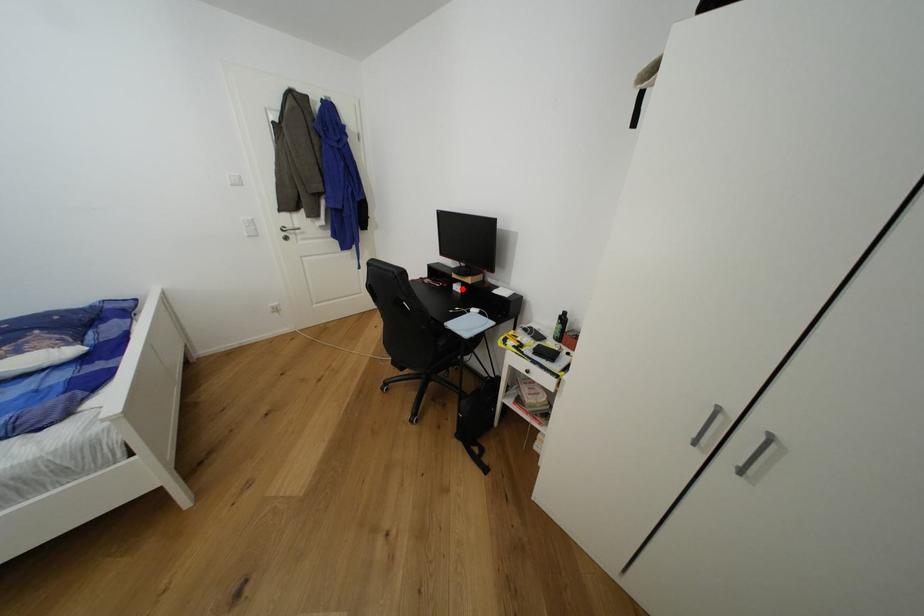
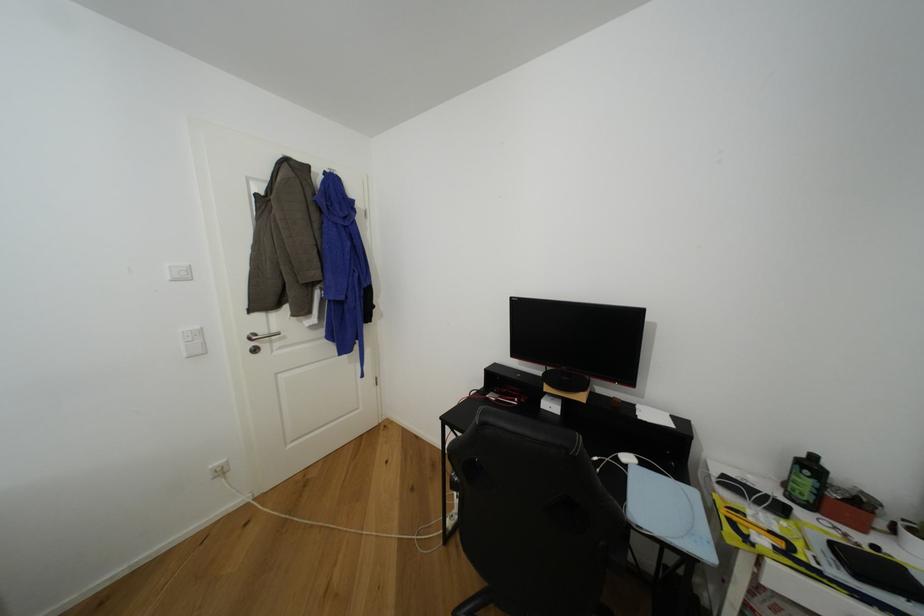
Find the pixel in the second image that matches the highlighted location in the first image.

(555, 408)